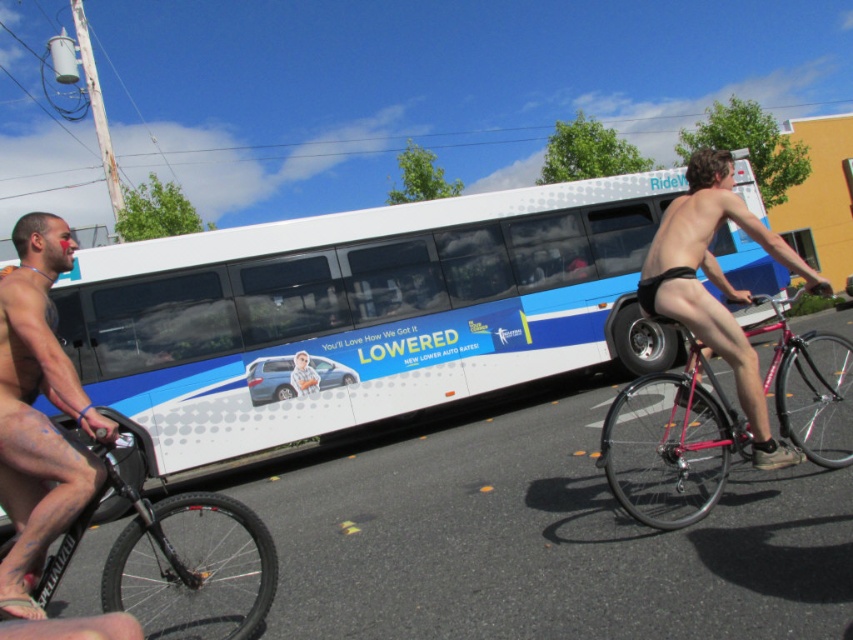
You are a delivery person who needs to place a sticker on the shiny red bicycle at center. According to the coordinates provided, where should you place the sticker on the bicycle?

The sticker should be placed at the position corresponding to the coordinates point [670,445] on the shiny red bicycle at center.

You are a delivery drone operator. You need to fly a drone from point A to point B in this street scene. The coordinates for point A are at [341,276] and point B are at [770,362]. According to the scene description, which point is closer to the large white bus with blue accents?

Point A at [341,276] is closer to the large white bus with blue accents because it is behind point B at [770,362], meaning point A is nearer to the bus located in the background.

You are a pedestrian standing on the sidewalk and see both the shiny red bicycle at center and the black matte bicycle at left. Which bicycle is closer to you?

The shiny red bicycle at center is closer to you because it is further to the viewer than the black matte bicycle at left.